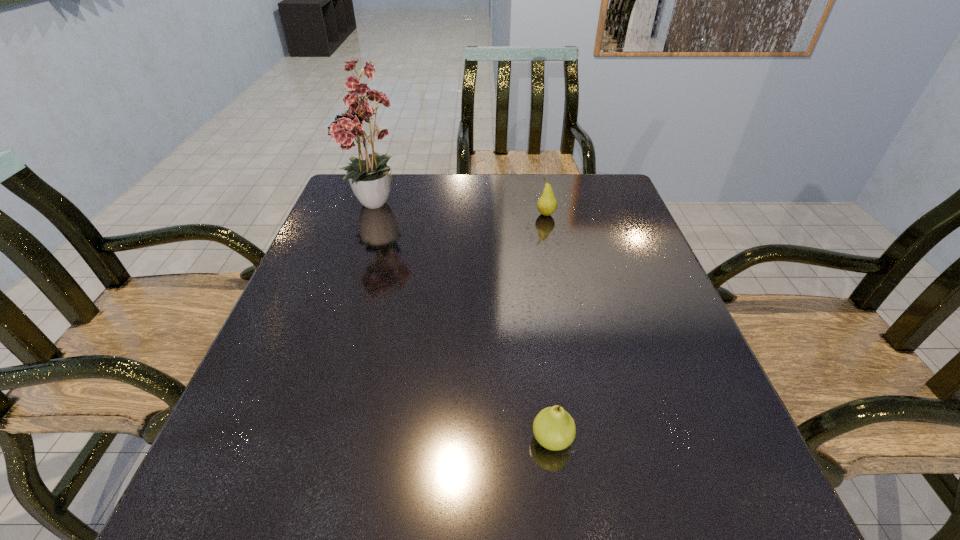
Where is `free space that is in between the tallest object and the left pear`? Image resolution: width=960 pixels, height=540 pixels. free space that is in between the tallest object and the left pear is located at coordinates (465, 322).

The height and width of the screenshot is (540, 960). Identify the location of unoccupied area between the leftmost object and the nearer pear. (465, 322).

This screenshot has width=960, height=540. Find the location of `free space between the second object from right to left and the tallest object`. free space between the second object from right to left and the tallest object is located at coordinates (465, 322).

Find the location of `vacant space in between the left pear and the flower arrangement`. vacant space in between the left pear and the flower arrangement is located at coordinates (465, 322).

Find the location of a particular element. The height and width of the screenshot is (540, 960). free space between the right pear and the left pear is located at coordinates (549, 327).

Locate an element on the screen. Image resolution: width=960 pixels, height=540 pixels. blank region between the leftmost object and the nearer pear is located at coordinates (465, 322).

Where is `free point between the tallest object and the farther pear`? free point between the tallest object and the farther pear is located at coordinates click(x=462, y=210).

You are a GUI agent. You are given a task and a screenshot of the screen. Output one action in this format:
    pyautogui.click(x=<x>, y=<y>)
    Task: Click on the free point between the right pear and the leftmost object
    Image resolution: width=960 pixels, height=540 pixels.
    Given the screenshot: What is the action you would take?
    pyautogui.click(x=462, y=210)

Locate an element on the screen. The image size is (960, 540). free space between the tallest object and the nearest object is located at coordinates (465, 322).

The height and width of the screenshot is (540, 960). In order to click on free space that is in between the rightmost object and the tallest object in this screenshot , I will do `click(462, 210)`.